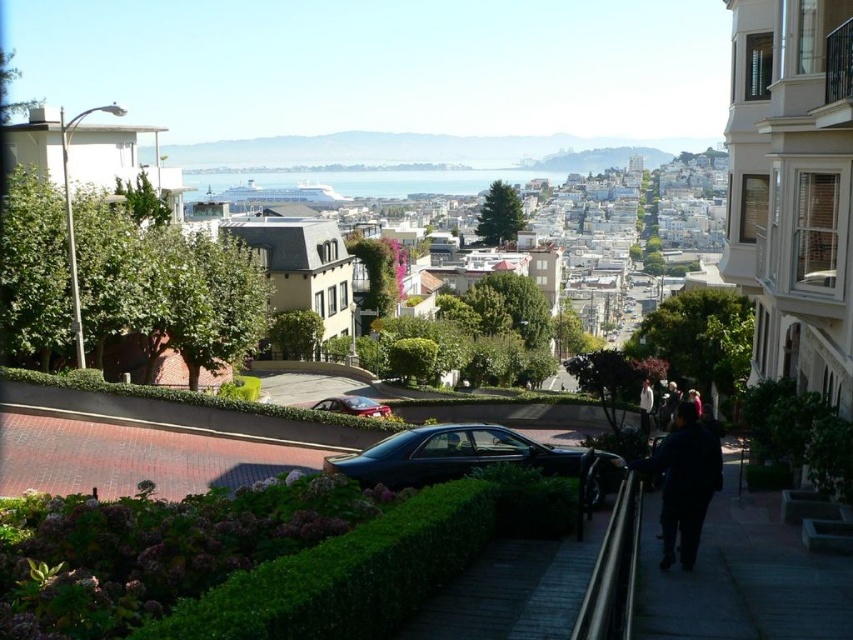
Question: Can you confirm if green grassy hillside at upper center is smaller than white glossy water at center?

Choices:
 (A) yes
 (B) no

Answer: (B)

Question: Is brick pavement at lower left to the left of dark blue jacket at lower right from the viewer's perspective?

Choices:
 (A) no
 (B) yes

Answer: (B)

Question: Is green grassy hillside at upper center smaller than shiny red car at center?

Choices:
 (A) yes
 (B) no

Answer: (B)

Question: Which object is positioned farthest from the white glossy water at center?

Choices:
 (A) dark blue jacket at lower right
 (B) shiny red car at center
 (C) glossy black car at center
 (D) green grassy hillside at upper center

Answer: (A)

Question: Which point is closer to the camera?

Choices:
 (A) (229, 452)
 (B) (524, 176)
 (C) (718, 445)

Answer: (C)

Question: Which point is farther to the camera?

Choices:
 (A) white glossy water at center
 (B) shiny red car at center

Answer: (A)